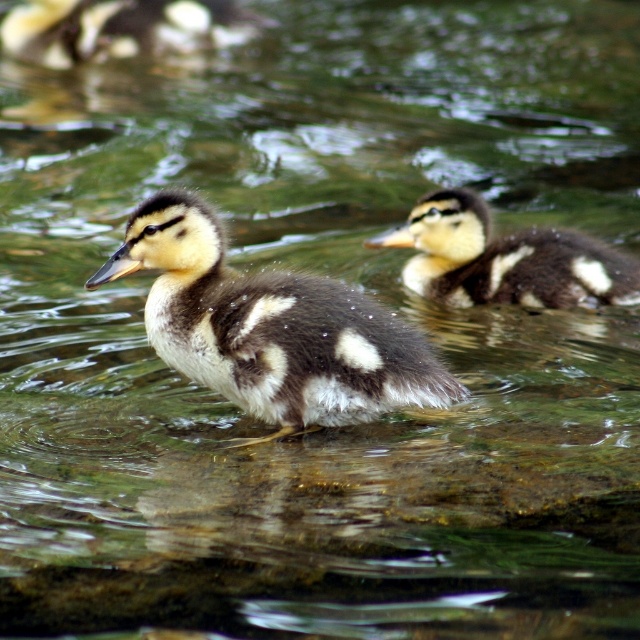
Question: Does soft brown duckling at center have a greater width compared to soft brown duckling at upper left?

Choices:
 (A) no
 (B) yes

Answer: (A)

Question: Which of the following is the farthest from the observer?

Choices:
 (A) (58, 29)
 (B) (573, 276)
 (C) (326, 307)

Answer: (A)

Question: Observing the image, what is the correct spatial positioning of brown speckled duckling at center in reference to soft brown duckling at center?

Choices:
 (A) right
 (B) left

Answer: (B)

Question: Which point is closer to the camera taking this photo?

Choices:
 (A) (426, 273)
 (B) (173, 44)

Answer: (A)

Question: Considering the real-world distances, which object is farthest from the soft brown duckling at center?

Choices:
 (A) soft brown duckling at upper left
 (B) brown speckled duckling at center

Answer: (A)

Question: Does soft brown duckling at center have a larger size compared to soft brown duckling at upper left?

Choices:
 (A) yes
 (B) no

Answer: (B)